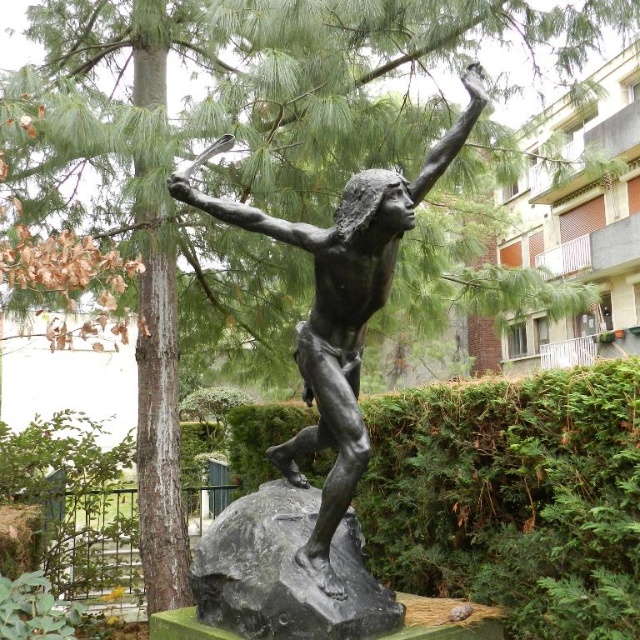
Question: Is bronze statue at center further to the viewer compared to black polished stone at center?

Choices:
 (A) no
 (B) yes

Answer: (A)

Question: Which object is farther from the camera taking this photo?

Choices:
 (A) bronze statue at center
 (B) black polished stone at center

Answer: (B)

Question: Which point is farther to the camera?

Choices:
 (A) (282, 451)
 (B) (234, 573)

Answer: (A)

Question: Is bronze statue at center positioned behind black polished stone at center?

Choices:
 (A) yes
 (B) no

Answer: (B)

Question: Which of the following is the farthest from the observer?

Choices:
 (A) black polished stone at center
 (B) bronze statue at center

Answer: (A)

Question: From the image, what is the correct spatial relationship of bronze statue at center in relation to black polished stone at center?

Choices:
 (A) left
 (B) right

Answer: (B)